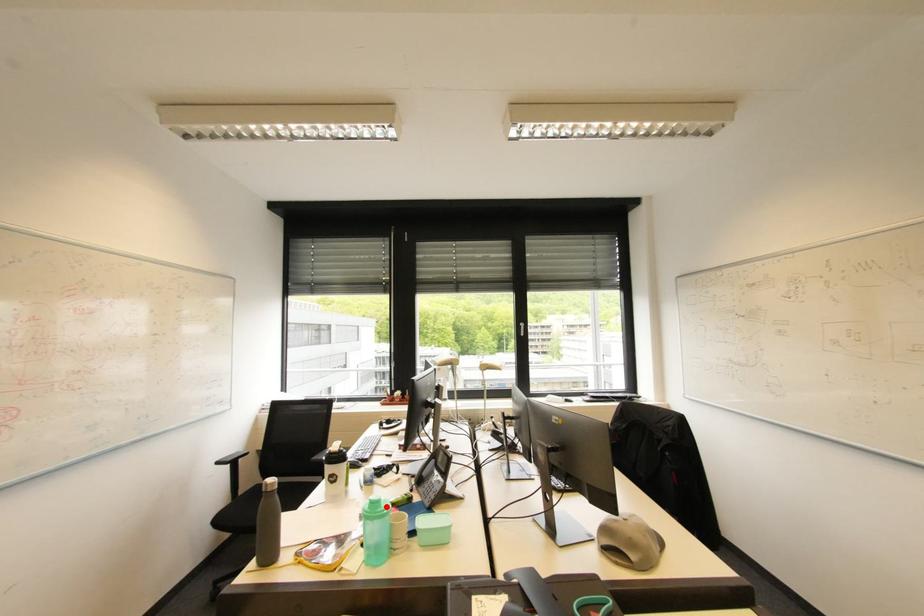
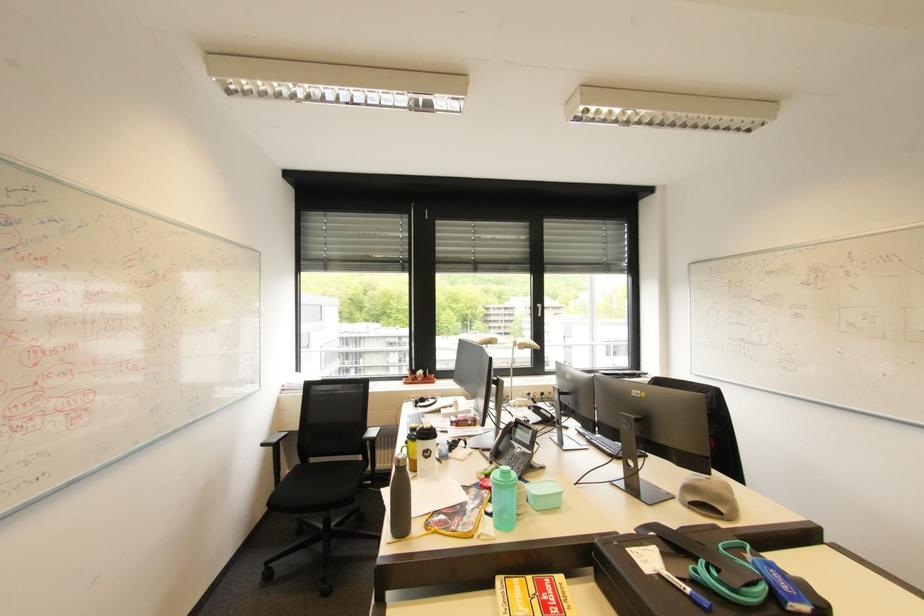
Question: I am providing you with two images of the same scene from different viewpoints. A red point is marked on the first image. At the location where the point appears in image 1, is it still visible in image 2?

Choices:
 (A) Yes
 (B) No

Answer: (A)